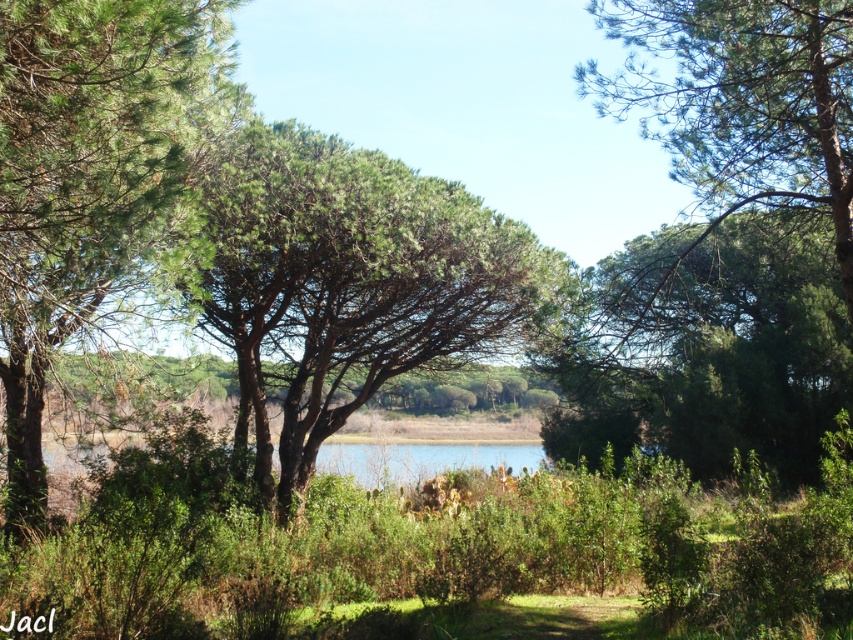
Question: Observing the image, what is the correct spatial positioning of green leafy tree at center in reference to green needle-like at left?

Choices:
 (A) above
 (B) below

Answer: (B)

Question: Which point is closer to the camera?

Choices:
 (A) green matte tree at center
 (B) green leafy tree at center
 (C) green needle-like at left

Answer: (C)

Question: Does green leafy tree at center appear over green needle-like at left?

Choices:
 (A) yes
 (B) no

Answer: (B)

Question: Does green leafy tree at center have a larger size compared to green needle-like at left?

Choices:
 (A) yes
 (B) no

Answer: (B)

Question: Which point is farther to the camera?

Choices:
 (A) green matte tree at center
 (B) green needle-like at left
 (C) green leafy tree at center

Answer: (C)

Question: Which object appears farthest from the camera in this image?

Choices:
 (A) green leafy tree at center
 (B) green needle-like at left

Answer: (A)